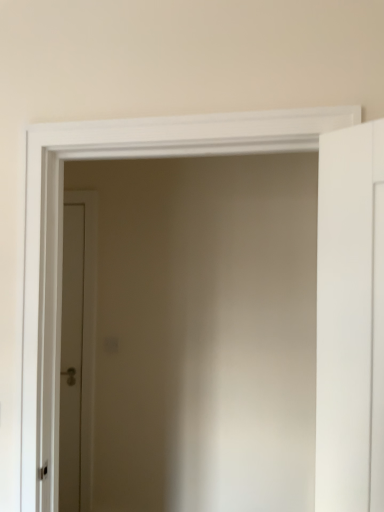
Question: Is brown matte door at center, positioned as the first door in back-to-front order, taller or shorter than white matte door at right, acting as the first door starting from the right?

Choices:
 (A) short
 (B) tall

Answer: (B)

Question: Looking at their shapes, would you say brown matte door at center, positioned as the first door in back-to-front order, is wider or thinner than white matte door at right, the 1th door viewed from the front?

Choices:
 (A) wide
 (B) thin

Answer: (B)

Question: Considering the positions of point (66, 508) and point (336, 172), is point (66, 508) closer or farther from the camera than point (336, 172)?

Choices:
 (A) closer
 (B) farther

Answer: (B)

Question: Is white matte door at right, the second door from the left, taller or shorter than brown matte door at center, the second door from the right?

Choices:
 (A) short
 (B) tall

Answer: (A)

Question: From a real-world perspective, relative to brown matte door at center, positioned as the first door in back-to-front order, is white matte door at right, the second door from the left, vertically above or below?

Choices:
 (A) above
 (B) below

Answer: (A)

Question: Which is correct: white matte door at right, arranged as the 2th door when viewed from the back, is inside brown matte door at center, positioned as the first door in back-to-front order, or outside of it?

Choices:
 (A) outside
 (B) inside

Answer: (A)

Question: Is point (357, 183) positioned closer to the camera than point (69, 321)?

Choices:
 (A) farther
 (B) closer

Answer: (B)